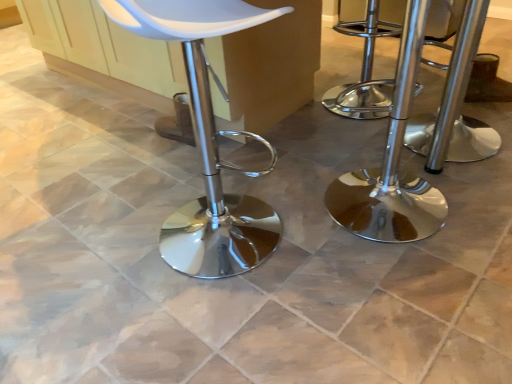
Find the location of a particular element. The width and height of the screenshot is (512, 384). vacant region to the left of chrome/metallic stool at right, acting as the first stool starting from the left is located at coordinates (291, 216).